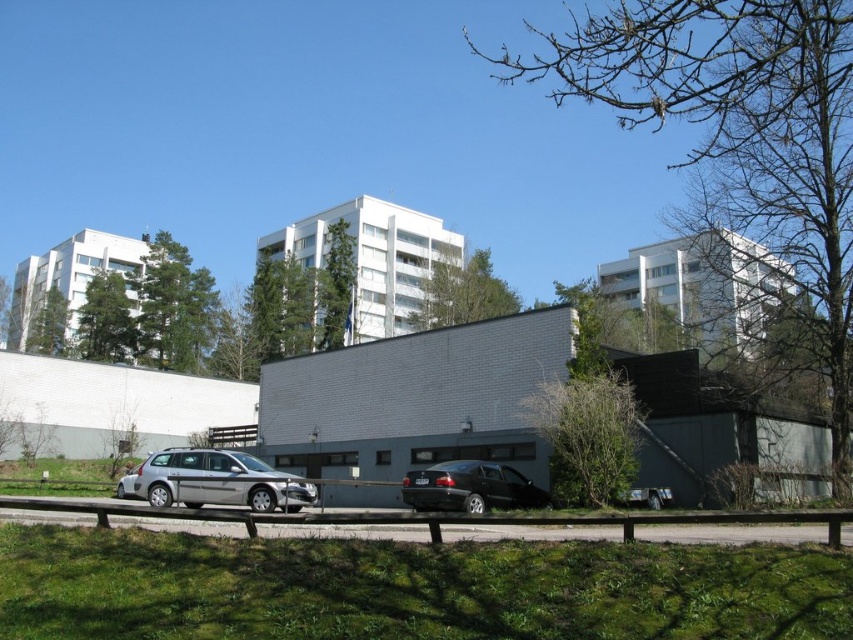
Does silver metallic station wagon at center appear over black glossy car at center?

No, silver metallic station wagon at center is not above black glossy car at center.

Is silver metallic station wagon at center shorter than black glossy car at center?

No, silver metallic station wagon at center is not shorter than black glossy car at center.

This screenshot has width=853, height=640. Describe the element at coordinates (213, 481) in the screenshot. I see `silver metallic station wagon at center` at that location.

This screenshot has height=640, width=853. I want to click on silver metallic station wagon at center, so click(213, 481).